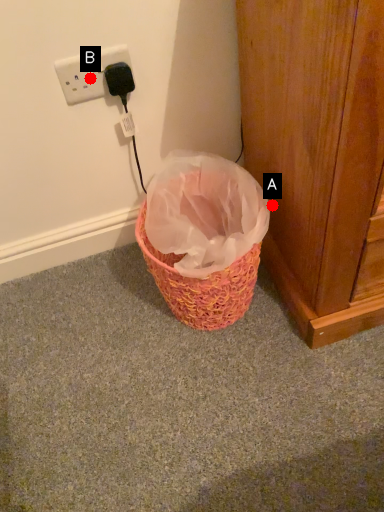
Question: Two points are circled on the image, labeled by A and B beside each circle. Which of the following is the closest to the observer?

Choices:
 (A) A is closer
 (B) B is closer

Answer: (B)